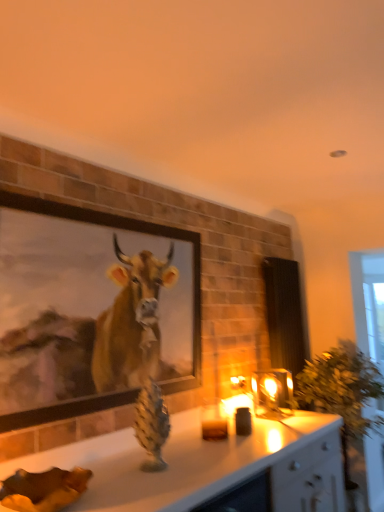
Question: Does wooden framed painting at upper left have a lesser height compared to green leafy plant at right?

Choices:
 (A) yes
 (B) no

Answer: (A)

Question: From the image's perspective, is wooden framed painting at upper left below green leafy plant at right?

Choices:
 (A) no
 (B) yes

Answer: (A)

Question: Is wooden framed painting at upper left wider than green leafy plant at right?

Choices:
 (A) no
 (B) yes

Answer: (A)

Question: From a real-world perspective, is wooden framed painting at upper left over green leafy plant at right?

Choices:
 (A) yes
 (B) no

Answer: (A)

Question: Could you tell me if wooden framed painting at upper left is facing green leafy plant at right?

Choices:
 (A) yes
 (B) no

Answer: (B)

Question: Is translucent glass candle at center taller or shorter than wooden framed painting at upper left?

Choices:
 (A) short
 (B) tall

Answer: (A)

Question: From a real-world perspective, is translucent glass candle at center above or below wooden framed painting at upper left?

Choices:
 (A) above
 (B) below

Answer: (B)

Question: From the image's perspective, is translucent glass candle at center positioned above or below wooden framed painting at upper left?

Choices:
 (A) above
 (B) below

Answer: (B)

Question: Considering the positions of translucent glass candle at center and wooden framed painting at upper left in the image, is translucent glass candle at center wider or thinner than wooden framed painting at upper left?

Choices:
 (A) thin
 (B) wide

Answer: (B)

Question: In terms of height, does translucent glass candle at center look taller or shorter compared to green leafy plant at right?

Choices:
 (A) tall
 (B) short

Answer: (B)

Question: From the image's perspective, relative to green leafy plant at right, is translucent glass candle at center above or below?

Choices:
 (A) above
 (B) below

Answer: (A)

Question: In the image, is translucent glass candle at center on the left side or the right side of green leafy plant at right?

Choices:
 (A) left
 (B) right

Answer: (A)

Question: Which is correct: translucent glass candle at center is inside green leafy plant at right, or outside of it?

Choices:
 (A) inside
 (B) outside

Answer: (B)

Question: In terms of height, does wooden framed painting at upper left look taller or shorter compared to translucent glass candle at center?

Choices:
 (A) tall
 (B) short

Answer: (A)

Question: Relative to translucent glass candle at center, is wooden framed painting at upper left in front or behind?

Choices:
 (A) behind
 (B) front

Answer: (B)